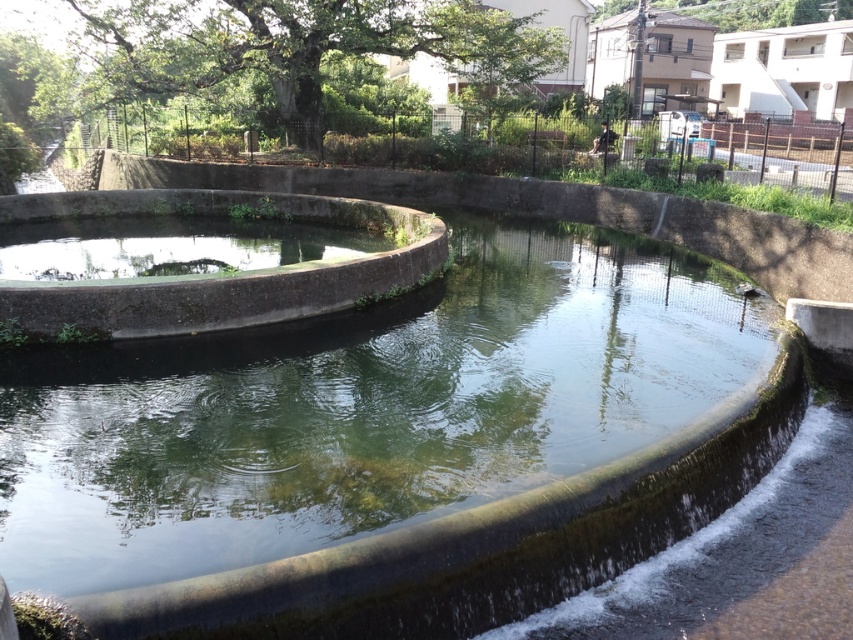
Question: Can you confirm if smooth concrete fountain at center is smaller than smooth concrete basin at center?

Choices:
 (A) yes
 (B) no

Answer: (B)

Question: From the image, what is the correct spatial relationship of smooth concrete fountain at center in relation to smooth concrete basin at center?

Choices:
 (A) below
 (B) above

Answer: (A)

Question: Which point is farther from the camera taking this photo?

Choices:
 (A) (96, 298)
 (B) (390, 582)

Answer: (A)

Question: Does smooth concrete fountain at center have a greater width compared to smooth concrete basin at center?

Choices:
 (A) yes
 (B) no

Answer: (A)